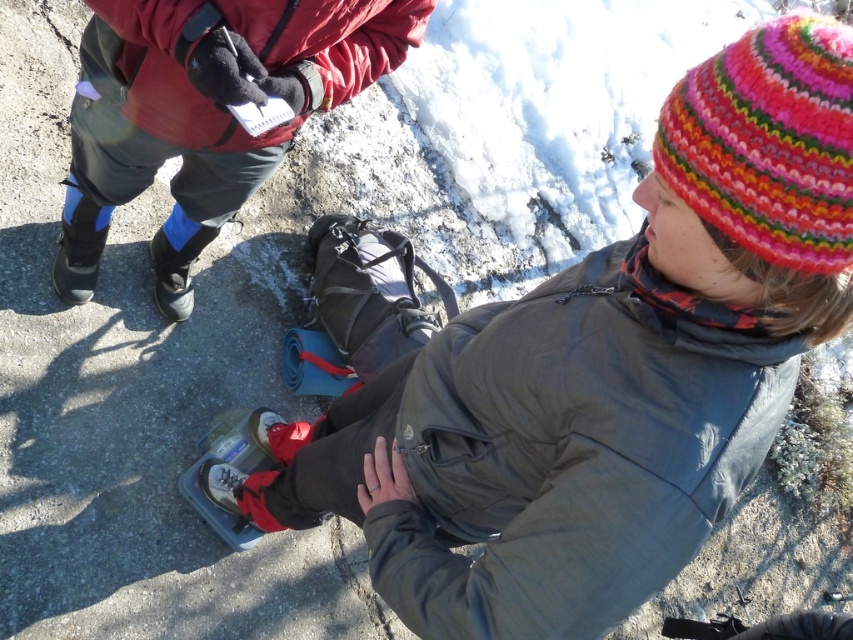
Based on the scene description, which object is positioned more to the left between the matte red jacket at upper left and the red fleece jacket at upper left?

The matte red jacket at upper left is positioned more to the left than the red fleece jacket at upper left according to the description.

You are standing in the snowy scene and want to locate the point at coordinates point (x=167, y=76). According to the scene description, where exactly is this point located?

The point (x=167, y=76) is located on the red fleece jacket at upper left.

You are trying to decide which item to place in a storage container that can only fit items narrower than the other. Based on their widths, which item should you choose between the matte red jacket at upper left and the matte blue ski boot at lower left?

The matte blue ski boot at lower left should be chosen because the matte red jacket at upper left is wider than the matte blue ski boot at lower left, so the boot is narrower and fits the container better.